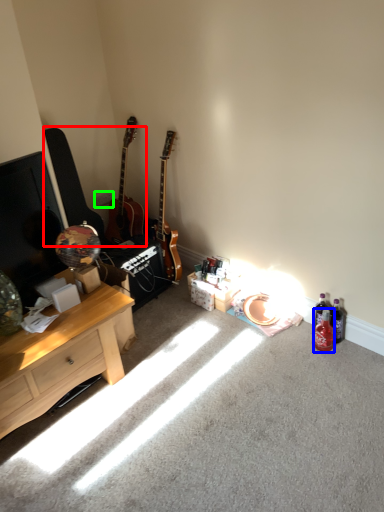
Question: Which object is positioned closest to guitars (highlighted by a red box)? Select from bottle (highlighted by a blue box) and power outlet (highlighted by a green box).

Choices:
 (A) bottle
 (B) power outlet

Answer: (B)